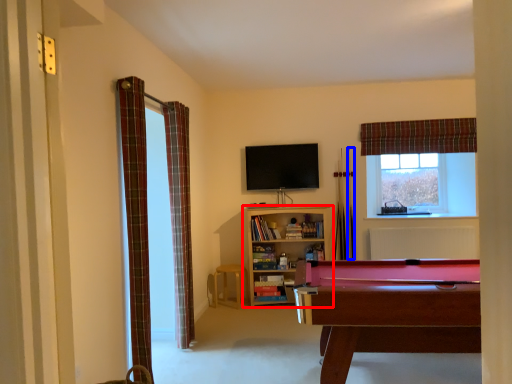
Question: Among these objects, which one is farthest to the camera, bookcase (highlighted by a red box) or cue (highlighted by a blue box)?

Choices:
 (A) bookcase
 (B) cue

Answer: (B)